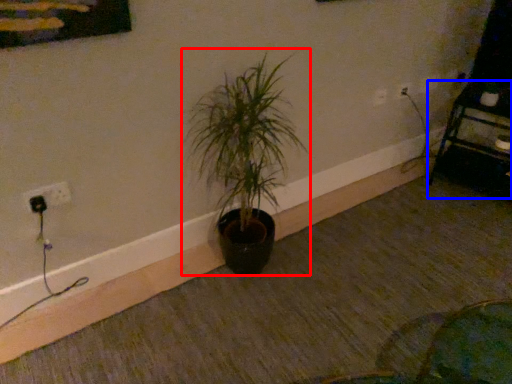
Question: Which object is closer to the camera taking this photo, houseplant (highlighted by a red box) or furniture (highlighted by a blue box)?

Choices:
 (A) houseplant
 (B) furniture

Answer: (A)